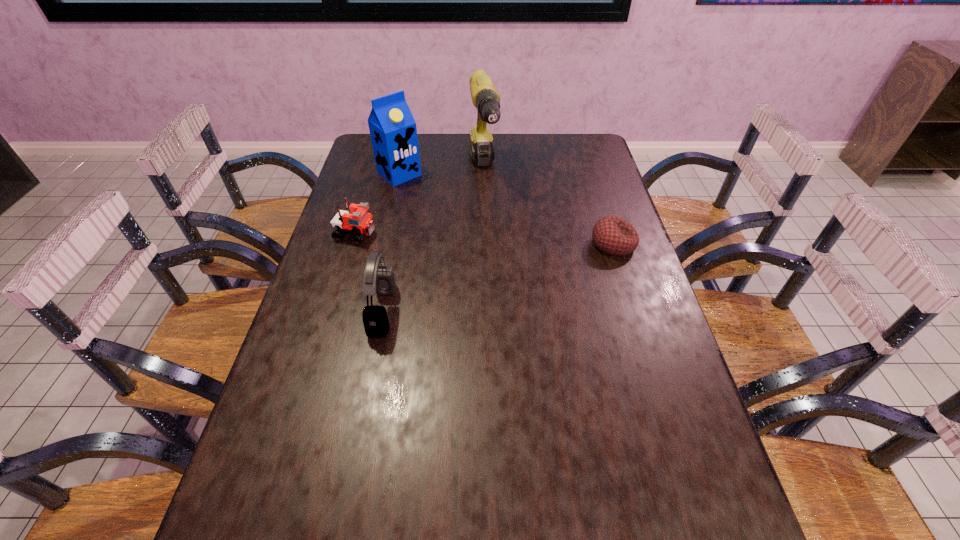
At what (x,y) coordinates should I click in order to perform the action: click on Lego that is at the left edge. Please return your answer as a coordinate pair (x, y). Looking at the image, I should click on (356, 220).

Where is `carton that is at the left edge`? carton that is at the left edge is located at coordinates (393, 131).

Where is `object present at the right edge`? Image resolution: width=960 pixels, height=540 pixels. object present at the right edge is located at coordinates (612, 235).

Identify the location of object that is at the far left corner. (393, 131).

The height and width of the screenshot is (540, 960). Identify the location of free location at the far edge of the desktop. pyautogui.click(x=457, y=154).

Where is `vacant region at the near edge`? vacant region at the near edge is located at coordinates (518, 483).

Find the location of a particular element. The image size is (960, 540). free space at the left edge of the desktop is located at coordinates (360, 177).

The height and width of the screenshot is (540, 960). In the image, there is a desktop. Identify the location of vacant region at the right edge. (566, 169).

I want to click on blank space at the far left corner, so click(365, 163).

Locate an element on the screen. The height and width of the screenshot is (540, 960). free space between the carton and the third tallest object is located at coordinates (391, 242).